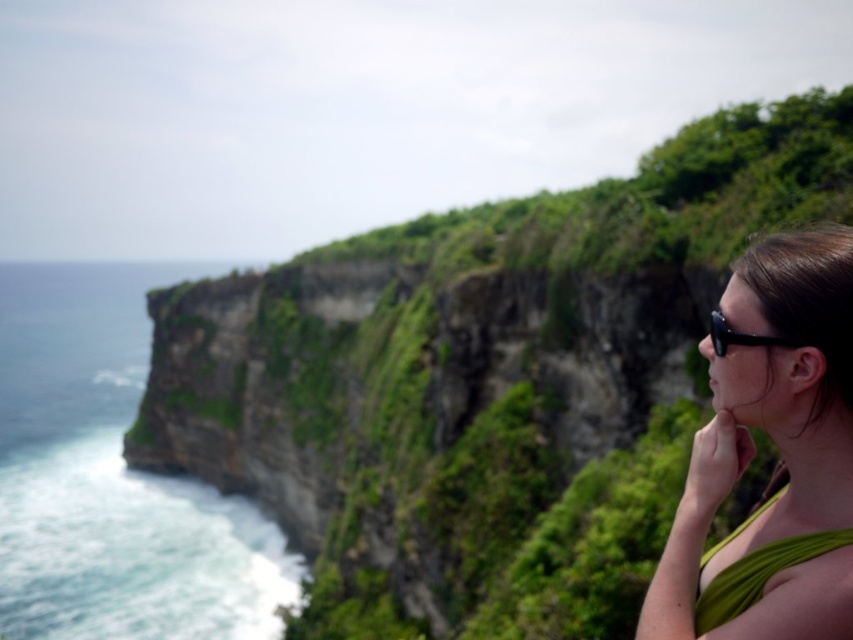
Is point (759, 241) farther from camera compared to point (700, 605)?

Yes.

From the picture: Measure the distance between point (688, 572) and camera.

→ A distance of 26.04 meters exists between point (688, 572) and camera.

Identify the location of green fabric top at right. pyautogui.click(x=779, y=451).

Identify the location of green fabric top at right. (779, 451).

Who is more distant from viewer, (741,572) or (712,308)?

The point (712,308) is more distant.

Is green fabric bikini top at right further to camera compared to black plastic goggles at right?

No, it is in front of black plastic goggles at right.

Who is more forward, [708,582] or [733,332]?

Point [708,582] is in front.

This screenshot has width=853, height=640. In order to click on green fabric bikini top at right in this screenshot , I will do `click(758, 573)`.

Is point (312, 310) less distant than point (734, 532)?

That is False.

The width and height of the screenshot is (853, 640). In order to click on green leafy vegetation at center in this screenshot , I will do `click(485, 384)`.

Describe the element at coordinates (485, 384) in the screenshot. This screenshot has width=853, height=640. I see `green leafy vegetation at center` at that location.

At what (x,y) coordinates should I click in order to perform the action: click on green leafy vegetation at center. Please return your answer as a coordinate pair (x, y). Looking at the image, I should click on (485, 384).